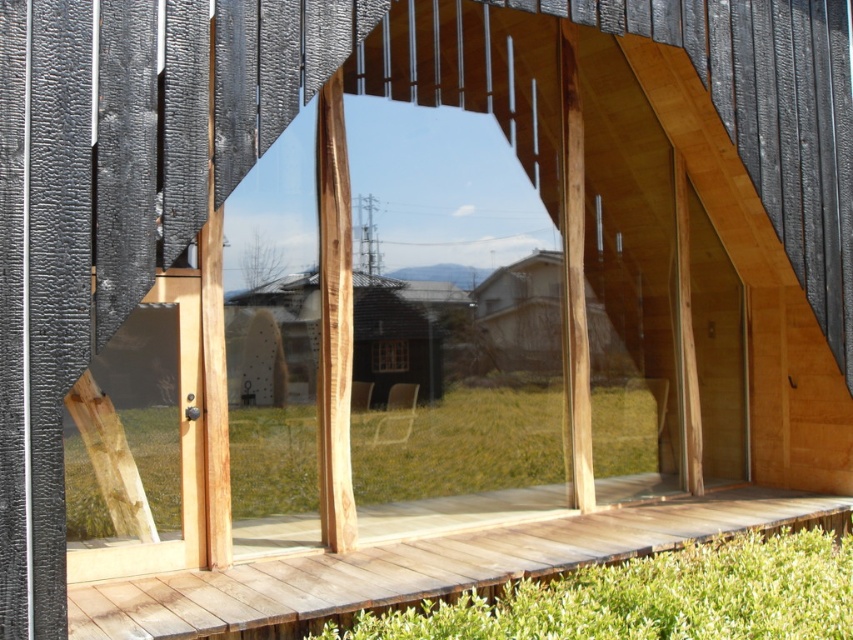
You are a visitor standing on the wooden deck in front of the wooden house at center and the transparent glass window at center. You want to take a photo of the traditional house with the sloped roof in the distance. Which object should you stand closer to for a better composition?

You should stand closer to the transparent glass window at center because the wooden house at center is much taller, which might block the view of the traditional house with the sloped roof in the distance.

You are standing in front of the modern architectural structure and want to enter through the transparent wood door at center. To do so, you need to go through the transparent glass window at center first. Is this possible based on their positions?

The transparent wood door at center is located above the transparent glass window at center, so you cannot go through the transparent glass window at center first to reach the transparent wood door at center because the door is positioned higher up.